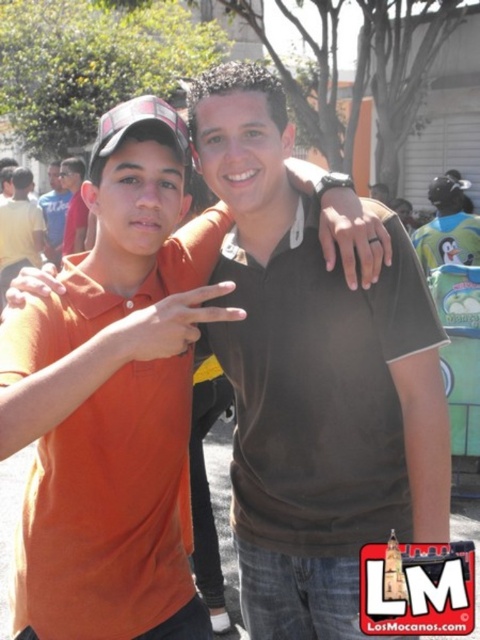
Does orange cotton shirt at center have a greater height compared to matte black shirt at center?

Incorrect, orange cotton shirt at center's height is not larger of matte black shirt at center's.

Can you confirm if orange cotton shirt at center is positioned below matte black shirt at center?

Correct, orange cotton shirt at center is located below matte black shirt at center.

Which is in front, point (129, 209) or point (50, 164)?

Positioned in front is point (129, 209).

The image size is (480, 640). I want to click on orange cotton shirt at center, so [x=134, y=193].

Can you confirm if orange cotton shirt at left is taller than matte orange shirt at left?

Yes, orange cotton shirt at left is taller than matte orange shirt at left.

Who is more distant from viewer, (34, 209) or (70, 200)?

The point (70, 200) is behind.

I want to click on orange cotton shirt at left, so click(19, 230).

Which of these two, orange cotton shirt at center or matte orange shirt at left, stands shorter?

matte orange shirt at left is shorter.

Between orange cotton shirt at center and matte orange shirt at left, which one appears on the left side from the viewer's perspective?

Positioned to the left is matte orange shirt at left.

The width and height of the screenshot is (480, 640). What do you see at coordinates (134, 193) in the screenshot?
I see `orange cotton shirt at center` at bounding box center [134, 193].

Where is `orange cotton shirt at center`? This screenshot has width=480, height=640. orange cotton shirt at center is located at coordinates (134, 193).